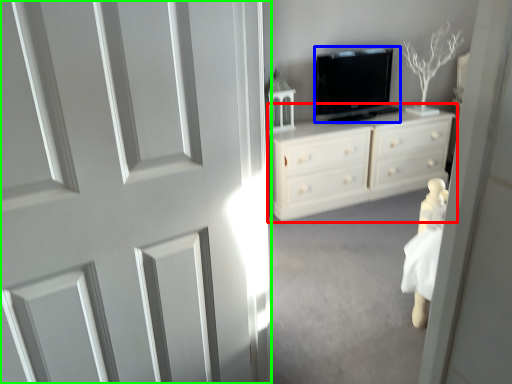
Question: Estimate the real-world distances between objects in this image. Which object is closer to chest of drawers (highlighted by a red box), television (highlighted by a blue box) or door (highlighted by a green box)?

Choices:
 (A) television
 (B) door

Answer: (A)